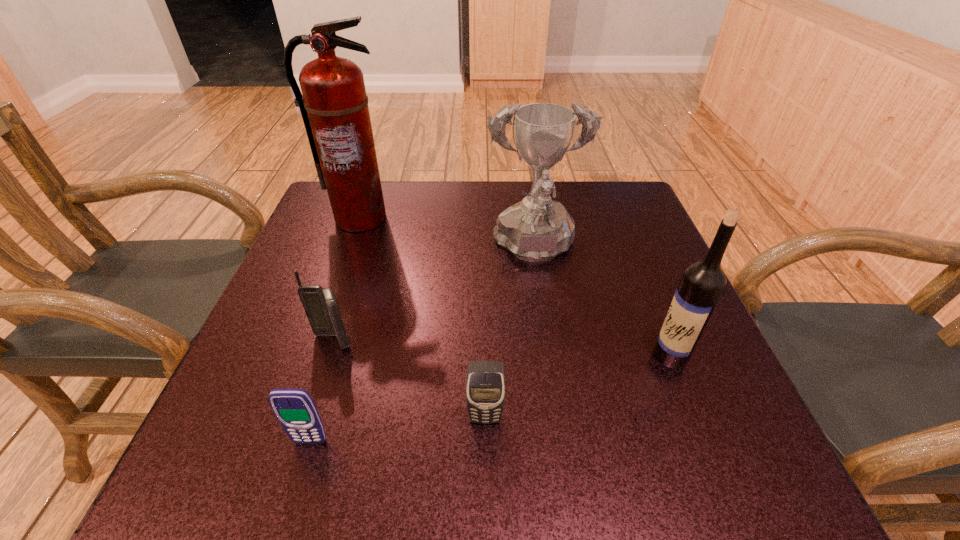
Locate an element on the screen. The height and width of the screenshot is (540, 960). free point between the nearest cellular telephone and the farthest cellular telephone is located at coordinates (322, 392).

This screenshot has height=540, width=960. What are the coordinates of `vacant region between the second nearest cellular telephone and the award` in the screenshot? It's located at (510, 334).

Where is `free area in between the rightmost cellular telephone and the farthest cellular telephone`? This screenshot has width=960, height=540. free area in between the rightmost cellular telephone and the farthest cellular telephone is located at coordinates (409, 380).

Where is `vacant space that is in between the award and the fire extinguisher`? vacant space that is in between the award and the fire extinguisher is located at coordinates (446, 234).

The image size is (960, 540). Find the location of `free space between the tallest object and the farthest cellular telephone`. free space between the tallest object and the farthest cellular telephone is located at coordinates (347, 280).

Locate an element on the screen. This screenshot has width=960, height=540. vacant area that lies between the wine bottle and the farthest cellular telephone is located at coordinates (502, 348).

Locate an element on the screen. This screenshot has width=960, height=540. blank region between the wine bottle and the rightmost cellular telephone is located at coordinates (578, 387).

Locate which object ranks in proximity to the nearest cellular telephone. Please provide its 2D coordinates. Your answer should be formatted as a tuple, i.e. [(x, y)], where the tuple contains the x and y coordinates of a point satisfying the conditions above.

[(320, 305)]

You are a GUI agent. You are given a task and a screenshot of the screen. Output one action in this format:
    pyautogui.click(x=<x>, y=<y>)
    Task: Click on the object that is the third closest one to the wine bottle
    The height and width of the screenshot is (540, 960).
    Given the screenshot: What is the action you would take?
    pyautogui.click(x=320, y=305)

The height and width of the screenshot is (540, 960). In order to click on the second closest cellular telephone to the rightmost cellular telephone in this screenshot , I will do `click(320, 305)`.